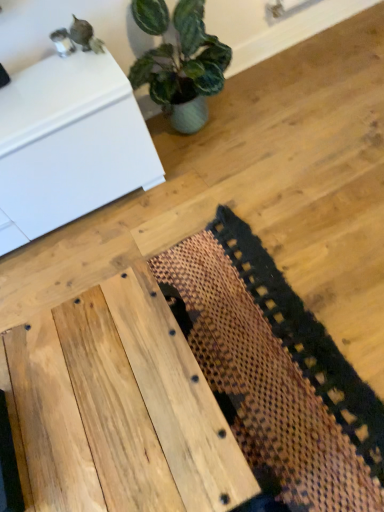
This screenshot has width=384, height=512. Identify the location of unoccupied region to the right of natural wood table at center. (278, 357).